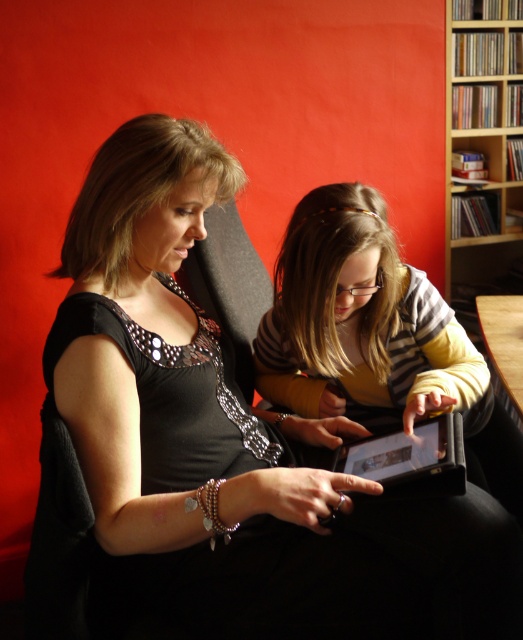
Question: Does matte black tablet at center have a lesser width compared to wooden bookshelf at upper right?

Choices:
 (A) no
 (B) yes

Answer: (A)

Question: Does matte black tablet at center have a lesser width compared to wooden bookshelf at upper right?

Choices:
 (A) no
 (B) yes

Answer: (A)

Question: Which point appears farthest from the camera in this image?

Choices:
 (A) (377, 244)
 (B) (496, 176)

Answer: (B)

Question: Is matte black tablet at center to the right of wooden bookshelf at upper right from the viewer's perspective?

Choices:
 (A) yes
 (B) no

Answer: (B)